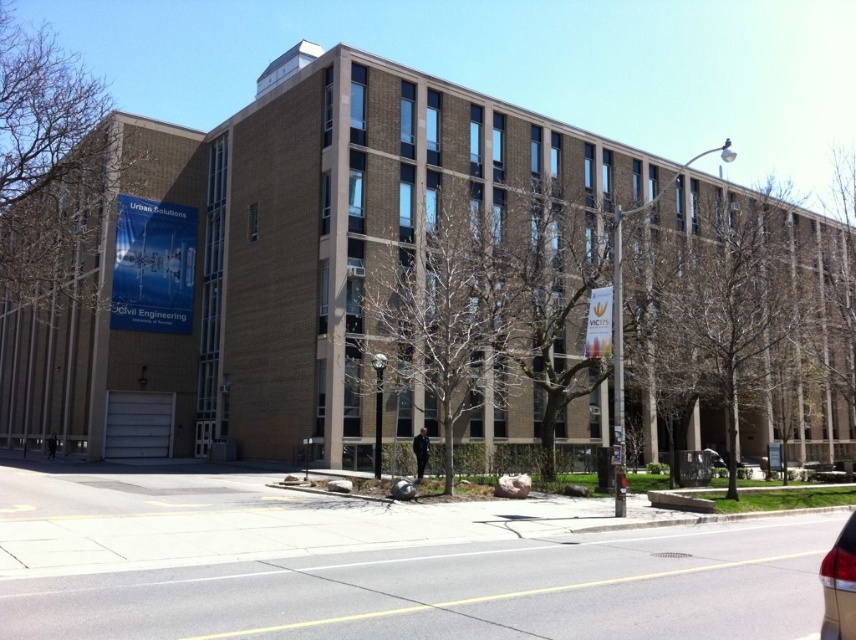
Question: Which object is closer to the camera taking this photo?

Choices:
 (A) brown brick building at center
 (B) shiny red tail light at lower right

Answer: (B)

Question: Is brown brick building at center thinner than shiny red tail light at lower right?

Choices:
 (A) yes
 (B) no

Answer: (B)

Question: From the image, what is the correct spatial relationship of brown brick building at center in relation to shiny red tail light at lower right?

Choices:
 (A) left
 (B) right

Answer: (B)

Question: Is brown brick building at center below shiny red tail light at lower right?

Choices:
 (A) no
 (B) yes

Answer: (A)

Question: Which object appears farthest from the camera in this image?

Choices:
 (A) brown brick building at center
 (B) shiny red tail light at lower right

Answer: (A)